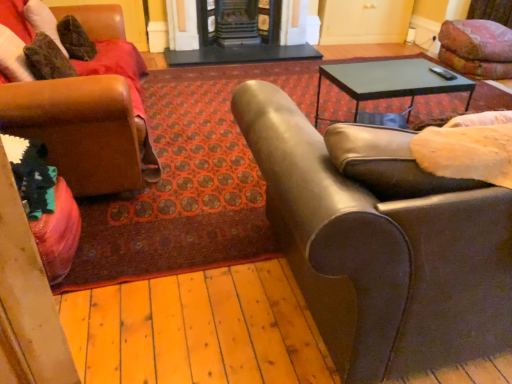
Question: Is leather at left, the 1th chair in the left-to-right sequence, inside the boundaries of black glossy table at center, or outside?

Choices:
 (A) outside
 (B) inside

Answer: (A)

Question: Is leather at left, the 1th chair in the left-to-right sequence, taller or shorter than black glossy table at center?

Choices:
 (A) short
 (B) tall

Answer: (B)

Question: Which object is the closest to the metallic gray table at upper right?

Choices:
 (A) marble fireplace at center, which is counted as the 1th fireplace, starting from the right
 (B) black glossy table at center
 (C) marble fireplace at center, which is the first fireplace from left to right
 (D) velvet pink cushion at upper right
 (E) leather couch at right, the 2th chair when ordered from left to right

Answer: (D)

Question: Based on their relative distances, which object is farther from the metallic gray table at upper right?

Choices:
 (A) leather couch at right, the 2th chair when ordered from left to right
 (B) leather at left, which is the 2th chair from right to left
 (C) marble fireplace at center, the second fireplace positioned from the left
 (D) marble fireplace at center, arranged as the 2th fireplace when viewed from the right
 (E) velvet pink cushion at upper right

Answer: (D)